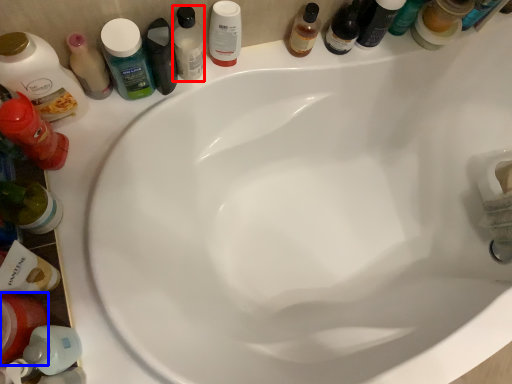
Question: Among these objects, which one is nearest to the camera, mouthwash (highlighted by a red box) or mouthwash (highlighted by a blue box)?

Choices:
 (A) mouthwash
 (B) mouthwash

Answer: (B)